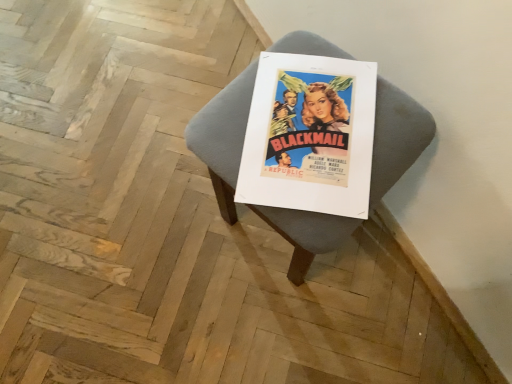
This screenshot has height=384, width=512. I want to click on free space to the left of matte gray cushion at center, so click(x=173, y=228).